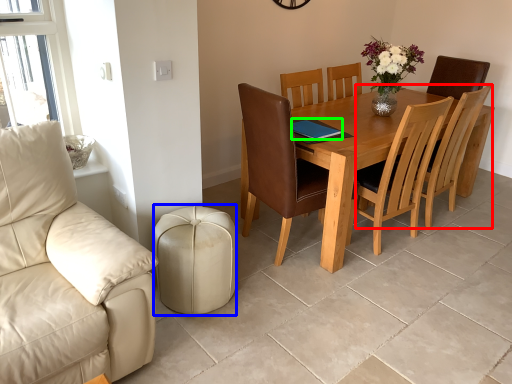
Question: Considering the real-world distances, which object is closest to chair (highlighted by a red box)? stool (highlighted by a blue box) or pad (highlighted by a green box).

Choices:
 (A) stool
 (B) pad

Answer: (B)